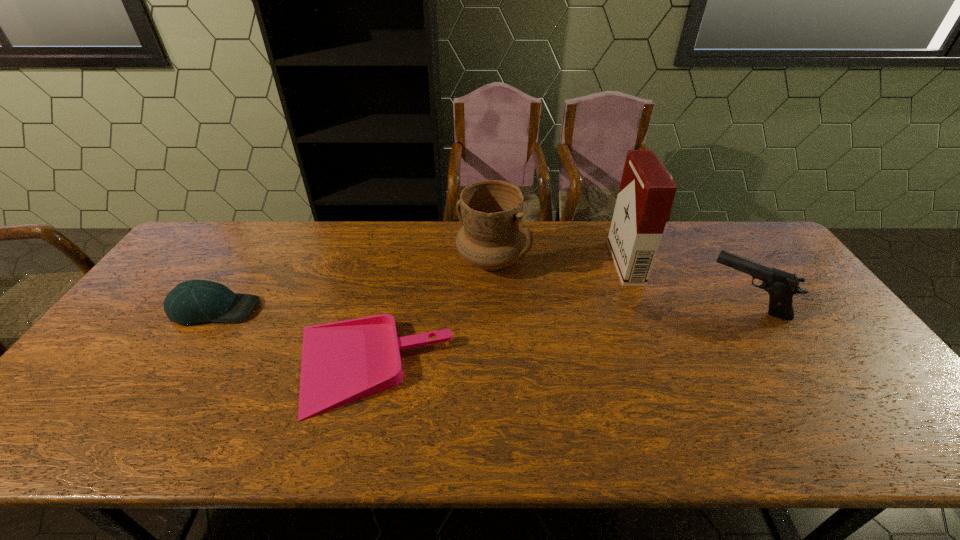
Where is `cigarette_case`? The width and height of the screenshot is (960, 540). cigarette_case is located at coordinates (646, 193).

At what (x,y) coordinates should I click in order to perform the action: click on the tallest object. Please return your answer as a coordinate pair (x, y). The image size is (960, 540). Looking at the image, I should click on (646, 193).

You are a GUI agent. You are given a task and a screenshot of the screen. Output one action in this format:
    pyautogui.click(x=<x>, y=<y>)
    Task: Click on the pottery
    This screenshot has height=540, width=960.
    Given the screenshot: What is the action you would take?
    pyautogui.click(x=493, y=235)

What are the coordinates of `the third shortest object` in the screenshot? It's located at (781, 286).

Identify the location of gun. This screenshot has width=960, height=540. (781, 286).

The height and width of the screenshot is (540, 960). What are the coordinates of `baseball cap` in the screenshot? It's located at (195, 301).

This screenshot has width=960, height=540. In order to click on the leftmost object in this screenshot , I will do `click(195, 301)`.

Locate an element on the screen. This screenshot has height=540, width=960. the shortest object is located at coordinates (342, 362).

Image resolution: width=960 pixels, height=540 pixels. I want to click on vacant space positioned 0.330m on the front-facing side of the second object from right to left, so click(x=512, y=263).

The width and height of the screenshot is (960, 540). I want to click on vacant space located on the front-facing side of the second object from right to left, so click(x=567, y=263).